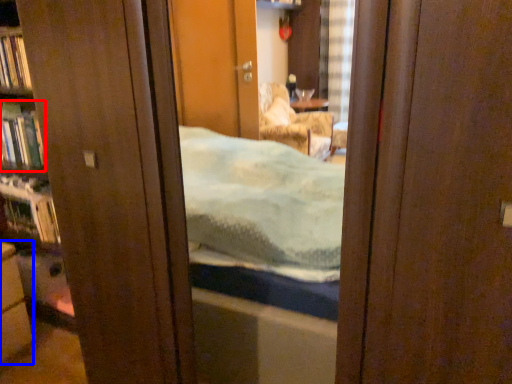
Question: Which point is further to the camera, book (highlighted by a red box) or cabinetry (highlighted by a blue box)?

Choices:
 (A) book
 (B) cabinetry

Answer: (A)